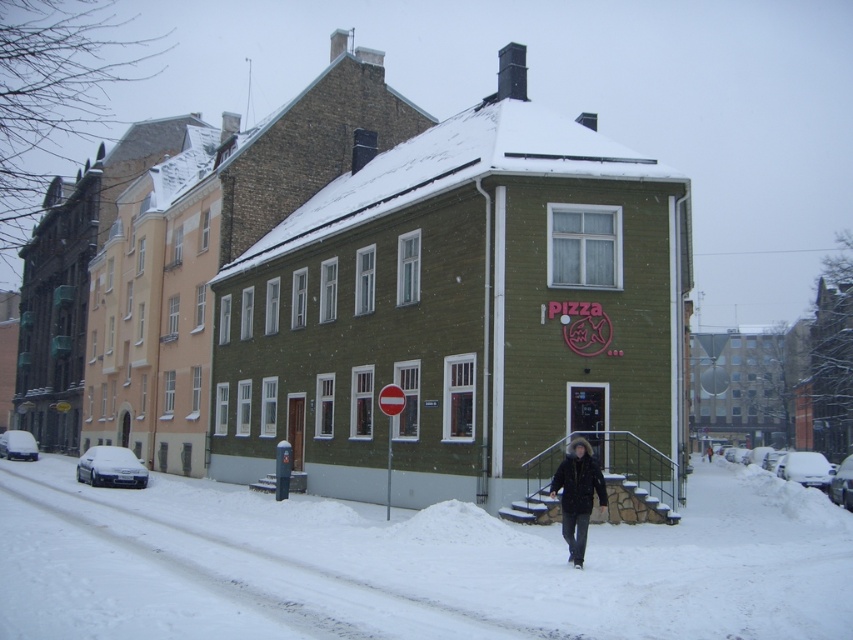
You are a delivery driver in a snowy city. You need to park your white matte car at lower right between two other cars. The space between the white matte car at left and the green pizza building is 2 meters. Can your car fit there?

The white matte car at lower right is thinner than the white matte car at left. Since the space between them is 2 meters, and the car to be parked is thinner, it should fit comfortably within the 2 meter space.

You are a delivery driver who needs to park your white matte car at lower right and white matte car at left in the parking lot. Which car should you move first to avoid blocking the other?

You should move the white matte car at lower right first because it is closer to the viewer and moving it first will prevent blocking access to the white matte car at left, which is further away.

You are a delivery person trying to park your van between the white matte car at lower left and the black glossy car at lower right. Based on the scene, can you fit your van which is 2 meters wide in the space between them?

The white matte car at lower left is located above the black glossy car at lower right, so there is no horizontal space between them for the van to park. The van cannot fit in the space between them.